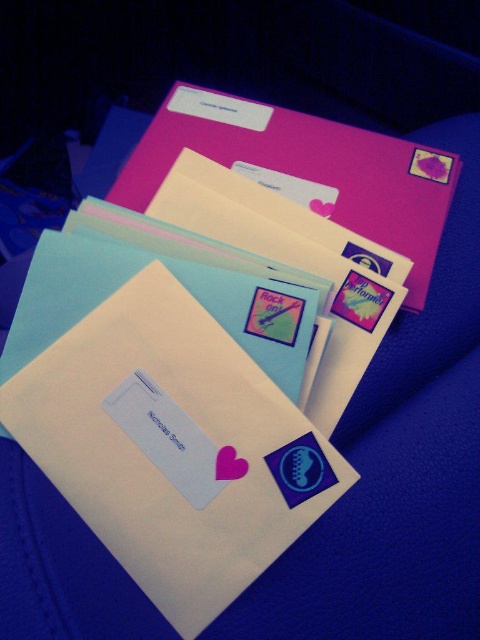
Which of these two, white paper envelope at center or matte pink envelope at upper center, stands taller?

Standing taller between the two is matte pink envelope at upper center.

Is white paper envelope at center above matte pink envelope at upper center?

No.

Does point (251, 566) come in front of point (355, 154)?

Yes, it is.

What are the coordinates of `white paper envelope at center` in the screenshot? It's located at (172, 448).